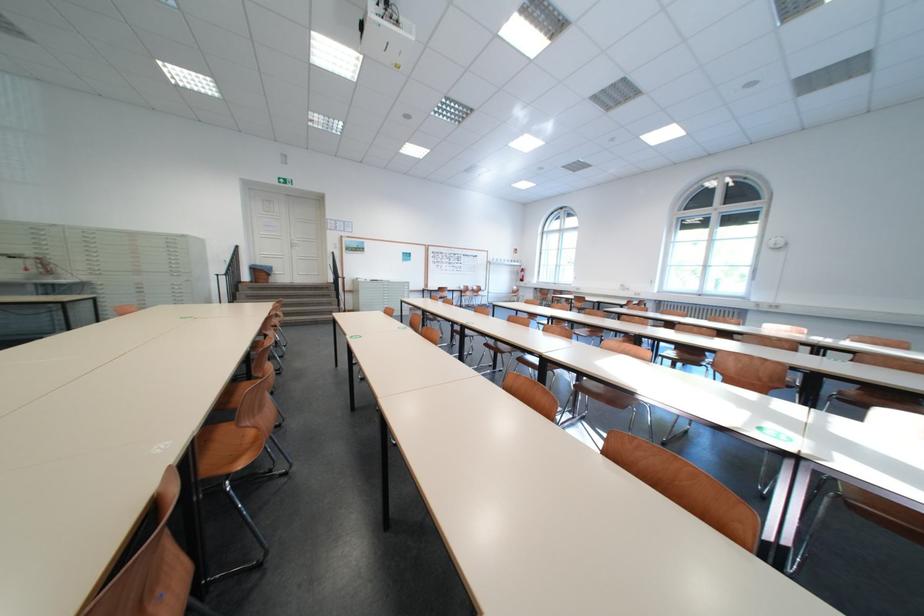
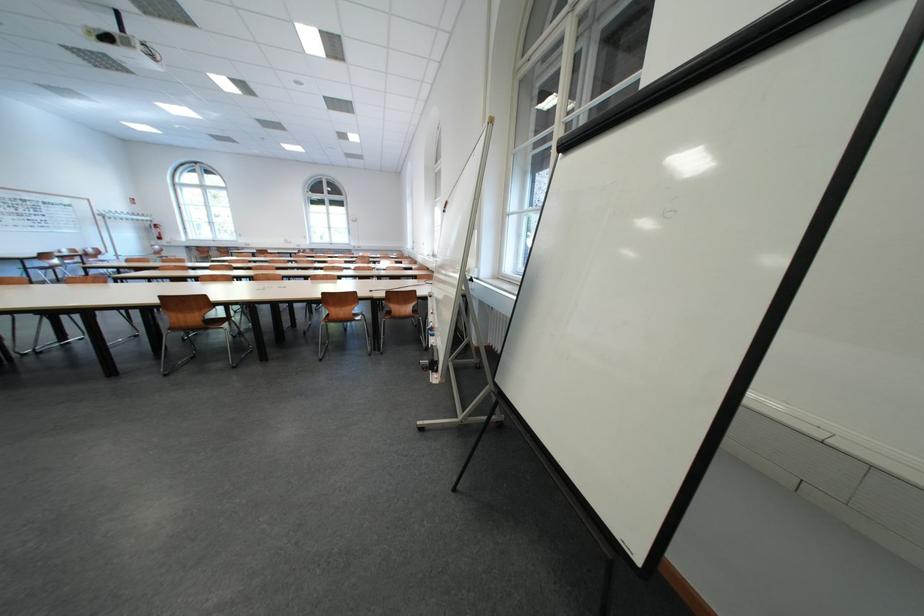
Question: I am providing you with two images of the same scene from different viewpoints. Please identify which objects are invisible in image2.

Choices:
 (A) brown chair surface
 (B) black paper clamp
 (C) brown chair sitting surface
 (D) black clothing item

Answer: (A)